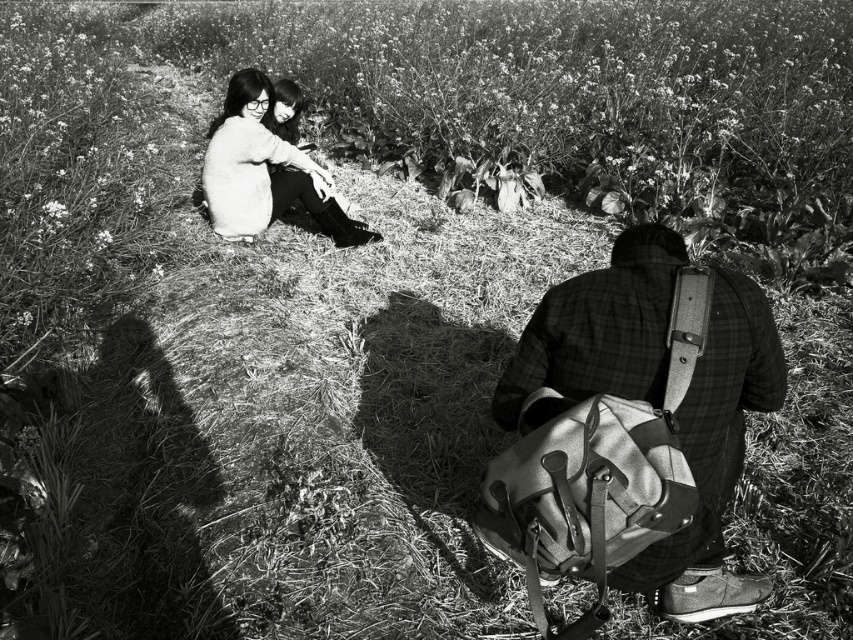
Based on the photo, which of these two, plaid fabric shirt at lower right or soft white sweater at upper left, stands shorter?

With less height is plaid fabric shirt at lower right.

Describe the element at coordinates (715, 458) in the screenshot. The height and width of the screenshot is (640, 853). I see `plaid fabric shirt at lower right` at that location.

I want to click on plaid fabric shirt at lower right, so click(715, 458).